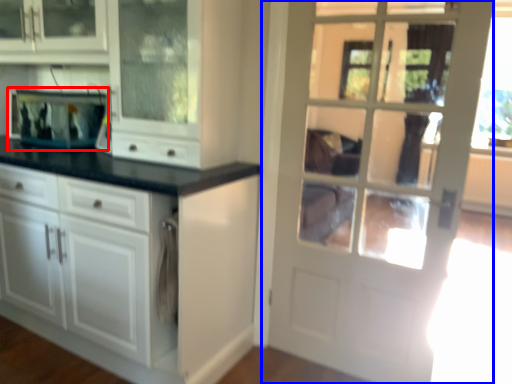
Question: Which object is further to the camera taking this photo, appliance (highlighted by a red box) or door (highlighted by a blue box)?

Choices:
 (A) appliance
 (B) door

Answer: (A)